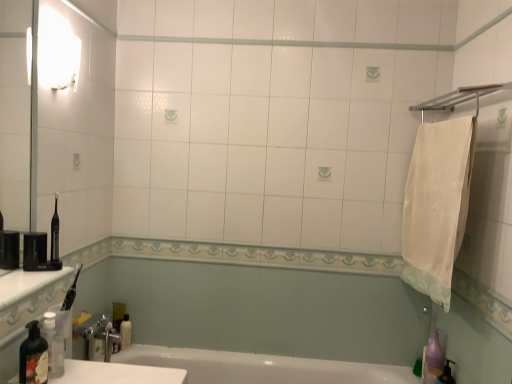
Question: Should I look upward or downward to see white glossy bottle at lower left?

Choices:
 (A) up
 (B) down

Answer: (B)

Question: Does transparent plastic bottle at lower left, the first bottle viewed from the back, contain white cotton towel at right?

Choices:
 (A) no
 (B) yes

Answer: (A)

Question: From a real-world perspective, is transparent plastic bottle at lower left, the 2th bottle from the front, below white cotton towel at right?

Choices:
 (A) yes
 (B) no

Answer: (A)

Question: Does transparent plastic bottle at lower left, the 2th bottle from the front, have a lesser height compared to white cotton towel at right?

Choices:
 (A) yes
 (B) no

Answer: (A)

Question: Is transparent plastic bottle at lower left, the 2th bottle from the front, smaller than white cotton towel at right?

Choices:
 (A) no
 (B) yes

Answer: (B)

Question: Is transparent plastic bottle at lower left, the first bottle viewed from the back, positioned with its back to white cotton towel at right?

Choices:
 (A) yes
 (B) no

Answer: (B)

Question: From a real-world perspective, is transparent plastic bottle at lower left, the first bottle viewed from the back, on white cotton towel at right?

Choices:
 (A) yes
 (B) no

Answer: (B)

Question: From the image's perspective, would you say white cotton towel at right is shown under translucent plastic soap dispenser at lower left, arranged as the 2th bottle when viewed from the back?

Choices:
 (A) yes
 (B) no

Answer: (B)

Question: Considering the relative sizes of white cotton towel at right and translucent plastic soap dispenser at lower left, the first bottle in the front-to-back sequence, in the image provided, is white cotton towel at right taller than translucent plastic soap dispenser at lower left, the first bottle in the front-to-back sequence,?

Choices:
 (A) no
 (B) yes

Answer: (B)

Question: Considering the relative sizes of white cotton towel at right and translucent plastic soap dispenser at lower left, the first bottle in the front-to-back sequence, in the image provided, is white cotton towel at right wider than translucent plastic soap dispenser at lower left, the first bottle in the front-to-back sequence,?

Choices:
 (A) yes
 (B) no

Answer: (A)

Question: Are white cotton towel at right and translucent plastic soap dispenser at lower left, arranged as the 2th bottle when viewed from the back, far apart?

Choices:
 (A) no
 (B) yes

Answer: (B)

Question: Is the depth of white cotton towel at right greater than that of translucent plastic soap dispenser at lower left, the first bottle in the front-to-back sequence?

Choices:
 (A) yes
 (B) no

Answer: (A)

Question: From a real-world perspective, is white cotton towel at right below translucent plastic soap dispenser at lower left, arranged as the 2th bottle when viewed from the back?

Choices:
 (A) no
 (B) yes

Answer: (A)

Question: Is transparent plastic bottle at lower left, the 2th bottle from the front, located outside white glossy bottle at lower left?

Choices:
 (A) yes
 (B) no

Answer: (A)